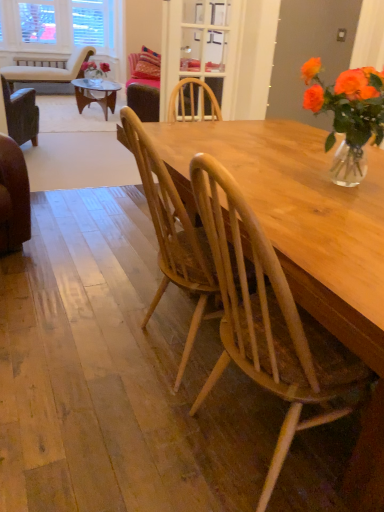
Question: Is clear glass door at upper center further to the viewer compared to translucent glass vase at upper right?

Choices:
 (A) no
 (B) yes

Answer: (B)

Question: Is clear glass door at upper center shorter than translucent glass vase at upper right?

Choices:
 (A) yes
 (B) no

Answer: (B)

Question: From the image's perspective, is clear glass door at upper center beneath translucent glass vase at upper right?

Choices:
 (A) no
 (B) yes

Answer: (A)

Question: Is clear glass door at upper center oriented towards translucent glass vase at upper right?

Choices:
 (A) no
 (B) yes

Answer: (B)

Question: From a real-world perspective, is clear glass door at upper center beneath translucent glass vase at upper right?

Choices:
 (A) yes
 (B) no

Answer: (B)

Question: In terms of size, does light brown wood chair at center, which appears as the second chair when viewed from the left, appear bigger or smaller than natural wood chair at center, placed as the 3th chair when sorted from left to right?

Choices:
 (A) big
 (B) small

Answer: (A)

Question: Based on their positions, is light brown wood chair at center, which appears as the second chair when viewed from the back, located to the left or right of natural wood chair at center, placed as the 3th chair when sorted from left to right?

Choices:
 (A) right
 (B) left

Answer: (B)

Question: In terms of width, does light brown wood chair at center, the 2th chair viewed from the right, look wider or thinner when compared to natural wood chair at center, placed as the 1th chair when sorted from front to back?

Choices:
 (A) wide
 (B) thin

Answer: (A)

Question: Do you think light brown wood chair at center, the 2th chair when ordered from front to back, is within natural wood chair at center, placed as the 1th chair when sorted from front to back, or outside of it?

Choices:
 (A) outside
 (B) inside

Answer: (A)

Question: From the image's perspective, is light brown wood chair at center, which appears as the second chair when viewed from the left, positioned above or below beige fabric chair at upper left, the first chair from the left?

Choices:
 (A) above
 (B) below

Answer: (B)

Question: Considering the positions of light brown wood chair at center, which appears as the second chair when viewed from the back, and beige fabric chair at upper left, which ranks as the third chair in right-to-left order, in the image, is light brown wood chair at center, which appears as the second chair when viewed from the back, bigger or smaller than beige fabric chair at upper left, which ranks as the third chair in right-to-left order,?

Choices:
 (A) big
 (B) small

Answer: (B)

Question: Is light brown wood chair at center, the 2th chair when ordered from top to bottom, situated inside beige fabric chair at upper left, which ranks as the first chair in top-to-bottom order, or outside?

Choices:
 (A) outside
 (B) inside

Answer: (A)

Question: Is light brown wood chair at center, which appears as the second chair when viewed from the left, taller or shorter than beige fabric chair at upper left, which ranks as the first chair in top-to-bottom order?

Choices:
 (A) tall
 (B) short

Answer: (A)

Question: Is point (372, 88) positioned closer to the camera than point (11, 74)?

Choices:
 (A) closer
 (B) farther

Answer: (A)

Question: From a real-world perspective, is translucent glass vase at upper right above or below beige fabric chair at upper left, the third chair ordered from the bottom?

Choices:
 (A) below
 (B) above

Answer: (B)